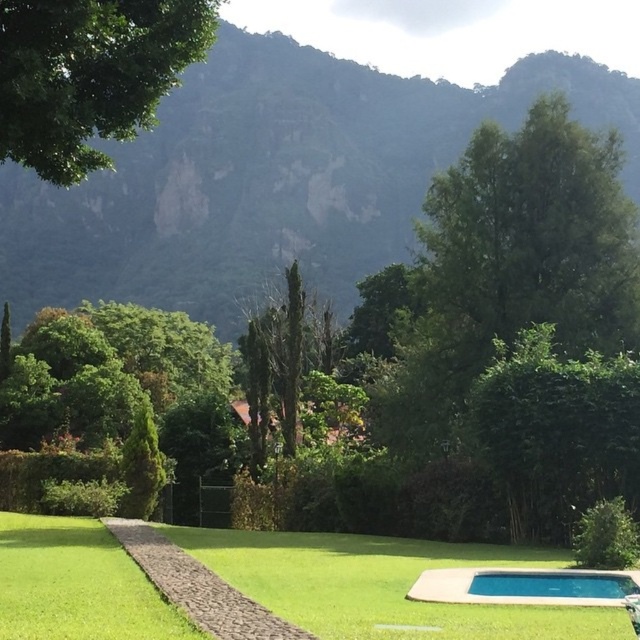
Question: Which object is closer to the camera taking this photo?

Choices:
 (A) green leafy tree at upper left
 (B) green leafy bush at center
 (C) blue smooth pool at lower right

Answer: (A)

Question: Considering the real-world distances, which object is farthest from the green leafy bush at center?

Choices:
 (A) blue smooth pool at lower right
 (B) green rocky mountain at upper center
 (C) green leafy tree at upper left

Answer: (B)

Question: Which of the following is the closest to the observer?

Choices:
 (A) (540, 472)
 (B) (132, 13)
 (C) (556, 602)

Answer: (B)

Question: Does green rocky mountain at upper center have a smaller size compared to blue smooth pool at lower right?

Choices:
 (A) no
 (B) yes

Answer: (A)

Question: Does green leafy bush at center come in front of blue smooth pool at lower right?

Choices:
 (A) no
 (B) yes

Answer: (A)

Question: Is green leafy tree at upper left positioned at the back of green leafy bush at center?

Choices:
 (A) yes
 (B) no

Answer: (B)